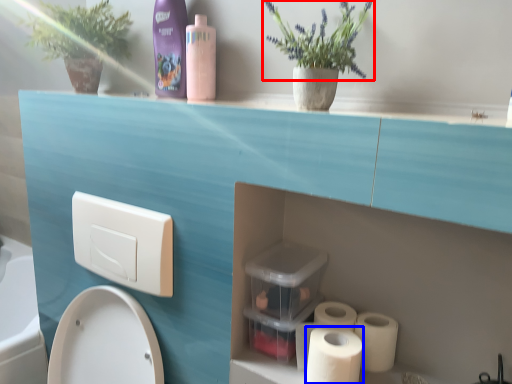
Question: Which object is closer to the camera taking this photo, flower (highlighted by a red box) or toilet paper (highlighted by a blue box)?

Choices:
 (A) flower
 (B) toilet paper

Answer: (A)